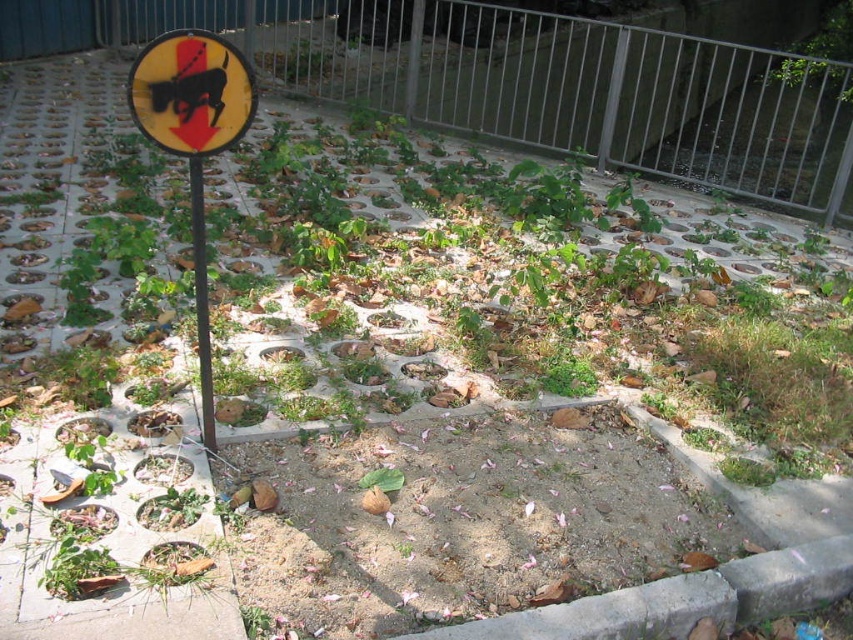
You are a hiker who wants to know which sign is taller between the yellow matte sign at upper left and the yellow reflective sign at upper left. Can you tell me which one is taller?

The yellow matte sign at upper left is much taller than the yellow reflective sign at upper left.